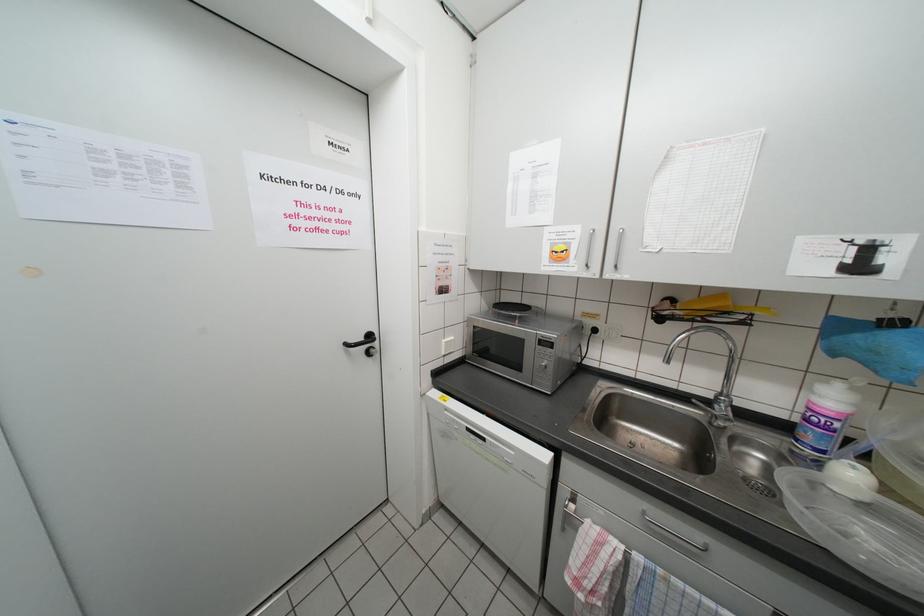
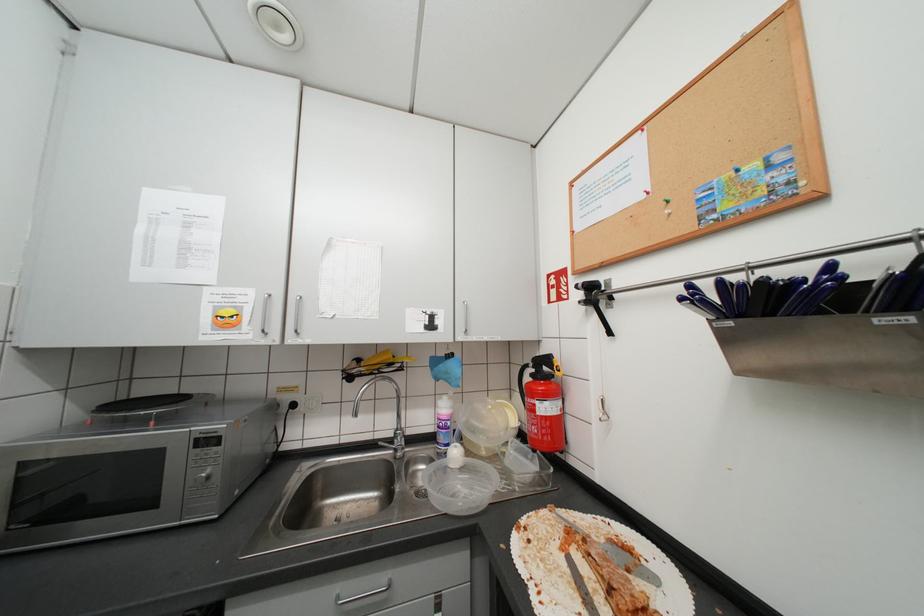
Question: How did the camera likely rotate?

Choices:
 (A) Left
 (B) Right
 (C) Up
 (D) Down

Answer: (B)